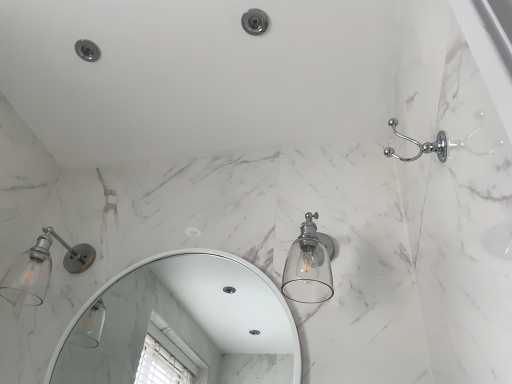
This screenshot has height=384, width=512. What do you see at coordinates (255, 21) in the screenshot?
I see `chrome metallic showerhead at upper center` at bounding box center [255, 21].

At what (x,y) coordinates should I click in order to perform the action: click on chrome metallic showerhead at upper center. Please return your answer as a coordinate pair (x, y). Looking at the image, I should click on point(255,21).

Describe the element at coordinates (183, 322) in the screenshot. I see `white glossy mirror at center` at that location.

The height and width of the screenshot is (384, 512). I want to click on chrome metallic showerhead at upper center, so (255, 21).

Between matte white bathtub at upper right and chrome metallic showerhead at upper center, which one has smaller size?

Smaller between the two is chrome metallic showerhead at upper center.

From a real-world perspective, which object stands above the other?

matte white bathtub at upper right.

Is matte white bathtub at upper right closer to the viewer compared to chrome metallic showerhead at upper center?

Yes, it is in front of chrome metallic showerhead at upper center.

Consider the image. Considering the positions of objects matte white bathtub at upper right and chrome metallic showerhead at upper center in the image provided, who is more to the right, matte white bathtub at upper right or chrome metallic showerhead at upper center?

chrome metallic showerhead at upper center.

From a real-world perspective, relative to chrome metallic showerhead at upper center, is clear glass light fixture at center-right, arranged as the second light fixture when viewed from the left, vertically above or below?

clear glass light fixture at center-right, arranged as the second light fixture when viewed from the left, is below chrome metallic showerhead at upper center.

From the image's perspective, is clear glass light fixture at center-right, the first light fixture positioned from the right, on chrome metallic showerhead at upper center?

No, from the image's perspective, clear glass light fixture at center-right, the first light fixture positioned from the right, is not above chrome metallic showerhead at upper center.

Is clear glass light fixture at center-right, the first light fixture positioned from the right, not inside chrome metallic showerhead at upper center?

Indeed, clear glass light fixture at center-right, the first light fixture positioned from the right, is completely outside chrome metallic showerhead at upper center.

What's the angular difference between clear glass light fixture at center-right, the first light fixture positioned from the right, and chrome metallic showerhead at upper center's facing directions?

They differ by 1.72 degrees in their facing directions.

Is chrome metallic showerhead at upper center not close to clear glass light fixture at center-right, the first light fixture positioned from the right?

No, chrome metallic showerhead at upper center is not far away from clear glass light fixture at center-right, the first light fixture positioned from the right.

Looking at this image, is chrome metallic showerhead at upper center taller or shorter than clear glass light fixture at center-right, the first light fixture positioned from the right?

chrome metallic showerhead at upper center is shorter than clear glass light fixture at center-right, the first light fixture positioned from the right.

Find the location of a particular element. Image resolution: width=512 pixels, height=384 pixels. shower behind the clear glass light fixture at center-right, the first light fixture positioned from the right is located at coordinates (255, 21).

Which is correct: chrome metallic showerhead at upper center is inside clear glass light fixture at center-right, arranged as the second light fixture when viewed from the left, or outside of it?

The correct answer is: outside.

This screenshot has width=512, height=384. Find the location of `bath located on the right of matte silver glass sconce at left, which is counted as the 1th light fixture, starting from the left`. bath located on the right of matte silver glass sconce at left, which is counted as the 1th light fixture, starting from the left is located at coordinates (200, 75).

Is matte white bathtub at upper right facing away from matte silver glass sconce at left, which is counted as the 1th light fixture, starting from the left?

matte white bathtub at upper right does not have its back to matte silver glass sconce at left, which is counted as the 1th light fixture, starting from the left.

Is matte white bathtub at upper right positioned beyond the bounds of matte silver glass sconce at left, which is counted as the 1th light fixture, starting from the left?

That's correct, matte white bathtub at upper right is outside of matte silver glass sconce at left, which is counted as the 1th light fixture, starting from the left.

The image size is (512, 384). I want to click on light fixture lying below the clear glass light fixture at center-right, arranged as the second light fixture when viewed from the left (from the image's perspective), so click(41, 269).

Between matte silver glass sconce at left, arranged as the 2th light fixture when viewed from the right, and clear glass light fixture at center-right, arranged as the second light fixture when viewed from the left, which one has smaller width?

clear glass light fixture at center-right, arranged as the second light fixture when viewed from the left, is thinner.

From the image's perspective, which one is positioned higher, matte silver glass sconce at left, which is counted as the 1th light fixture, starting from the left, or clear glass light fixture at center-right, arranged as the second light fixture when viewed from the left?

From the image's view, clear glass light fixture at center-right, arranged as the second light fixture when viewed from the left, is above.

Would you say matte silver glass sconce at left, arranged as the 2th light fixture when viewed from the right, contains clear glass light fixture at center-right, arranged as the second light fixture when viewed from the left?

That's incorrect, clear glass light fixture at center-right, arranged as the second light fixture when viewed from the left, is not inside matte silver glass sconce at left, arranged as the 2th light fixture when viewed from the right.

Between white glossy mirror at center and clear glass light fixture at center-right, the first light fixture positioned from the right, which one has smaller width?

With smaller width is white glossy mirror at center.

From a real-world perspective, which object rests below the other?

white glossy mirror at center is physically lower.

Would you consider white glossy mirror at center to be distant from clear glass light fixture at center-right, arranged as the second light fixture when viewed from the left?

Yes, white glossy mirror at center and clear glass light fixture at center-right, arranged as the second light fixture when viewed from the left, are quite far apart.

From the image's perspective, relative to clear glass light fixture at center-right, arranged as the second light fixture when viewed from the left, is white glossy mirror at center above or below?

white glossy mirror at center is situated lower than clear glass light fixture at center-right, arranged as the second light fixture when viewed from the left, in the image.

Is point (29, 257) less distant than point (242, 26)?

No, it is not.

Is matte silver glass sconce at left, arranged as the 2th light fixture when viewed from the right, in front of chrome metallic showerhead at upper center?

Yes, matte silver glass sconce at left, arranged as the 2th light fixture when viewed from the right, is closer to the camera.

Which object is positioned more to the right, matte silver glass sconce at left, which is counted as the 1th light fixture, starting from the left, or chrome metallic showerhead at upper center?

Positioned to the right is chrome metallic showerhead at upper center.

You are a GUI agent. You are given a task and a screenshot of the screen. Output one action in this format:
    pyautogui.click(x=<x>, y=<y>)
    Task: Click on the shower on the right of matte white bathtub at upper right
    The height and width of the screenshot is (384, 512).
    Given the screenshot: What is the action you would take?
    pyautogui.click(x=255, y=21)

Where is `shower positioned vertically above the clear glass light fixture at center-right, the first light fixture positioned from the right (from a real-world perspective)`? shower positioned vertically above the clear glass light fixture at center-right, the first light fixture positioned from the right (from a real-world perspective) is located at coordinates (255, 21).

In the scene shown: Based on their spatial positions, is white glossy mirror at center or chrome metallic showerhead at upper center closer to clear glass light fixture at center-right, the first light fixture positioned from the right?

The object closer to clear glass light fixture at center-right, the first light fixture positioned from the right, is chrome metallic showerhead at upper center.

Looking at the image, which one is located further to white glossy mirror at center, matte silver glass sconce at left, arranged as the 2th light fixture when viewed from the right, or matte white bathtub at upper right?

matte white bathtub at upper right.

Looking at the image, which one is located further to matte silver glass sconce at left, arranged as the 2th light fixture when viewed from the right, chrome metallic showerhead at upper center or white glossy mirror at center?

chrome metallic showerhead at upper center.

Looking at the image, which one is located closer to matte white bathtub at upper right, matte silver glass sconce at left, arranged as the 2th light fixture when viewed from the right, or white glossy mirror at center?

matte silver glass sconce at left, arranged as the 2th light fixture when viewed from the right, is closer to matte white bathtub at upper right.

Looking at the image, which one is located closer to matte white bathtub at upper right, clear glass light fixture at center-right, the first light fixture positioned from the right, or matte silver glass sconce at left, which is counted as the 1th light fixture, starting from the left?

matte silver glass sconce at left, which is counted as the 1th light fixture, starting from the left, lies closer to matte white bathtub at upper right than the other object.

Considering their positions, is white glossy mirror at center positioned further to chrome metallic showerhead at upper center than matte silver glass sconce at left, which is counted as the 1th light fixture, starting from the left?

white glossy mirror at center is further to chrome metallic showerhead at upper center.

From the image, which object appears to be farther from matte silver glass sconce at left, which is counted as the 1th light fixture, starting from the left, matte white bathtub at upper right or white glossy mirror at center?

white glossy mirror at center lies further to matte silver glass sconce at left, which is counted as the 1th light fixture, starting from the left, than the other object.

When comparing their distances from clear glass light fixture at center-right, arranged as the second light fixture when viewed from the left, does matte silver glass sconce at left, which is counted as the 1th light fixture, starting from the left, or white glossy mirror at center seem closer?

matte silver glass sconce at left, which is counted as the 1th light fixture, starting from the left, lies closer to clear glass light fixture at center-right, arranged as the second light fixture when viewed from the left, than the other object.

In order to click on bath between chrome metallic showerhead at upper center and matte silver glass sconce at left, which is counted as the 1th light fixture, starting from the left, in the up-down direction in this screenshot , I will do `click(200, 75)`.

At what (x,y) coordinates should I click in order to perform the action: click on mirror between matte silver glass sconce at left, arranged as the 2th light fixture when viewed from the right, and clear glass light fixture at center-right, the first light fixture positioned from the right. Please return your answer as a coordinate pair (x, y). Image resolution: width=512 pixels, height=384 pixels. Looking at the image, I should click on (183, 322).

The height and width of the screenshot is (384, 512). I want to click on bath between chrome metallic showerhead at upper center and white glossy mirror at center from top to bottom, so click(x=200, y=75).

Find the location of a particular element. shower located between matte silver glass sconce at left, which is counted as the 1th light fixture, starting from the left, and clear glass light fixture at center-right, the first light fixture positioned from the right, in the left-right direction is located at coordinates (255, 21).